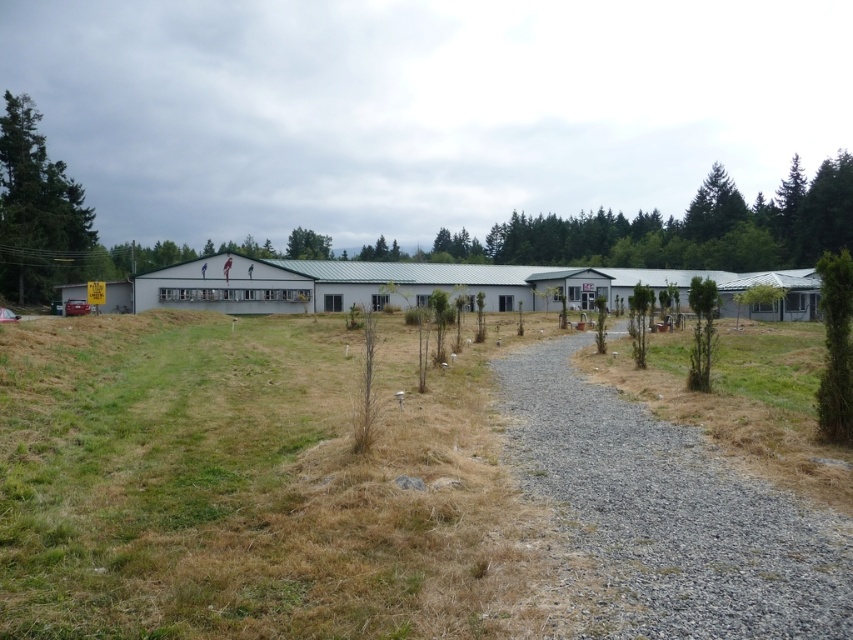
From the picture: Does gray gravel path at center have a lesser width compared to green textured tree at right?

Indeed, gray gravel path at center has a lesser width compared to green textured tree at right.

Who is more distant from viewer, (x=849, y=538) or (x=849, y=280)?

Point (x=849, y=280)

Is point (556, 372) in front of point (840, 301)?

No, (556, 372) is further to viewer.

The width and height of the screenshot is (853, 640). Identify the location of gray gravel path at center. (669, 515).

Between point (572, 392) and point (836, 422), which one is positioned in front?

Point (836, 422) is more forward.

At what (x,y) coordinates should I click in order to perform the action: click on brown dry grass at lower left. Please return your answer as a coordinate pair (x, y). Looking at the image, I should click on pos(373,496).

Identify the location of brown dry grass at lower left. pos(373,496).

Find the location of a particular element. brown dry grass at lower left is located at coordinates (373, 496).

Who is lower down, gray gravel path at center or green textured tree at left?

gray gravel path at center is lower down.

Is gray gravel path at center positioned at the back of green textured tree at left?

No, gray gravel path at center is in front of green textured tree at left.

The image size is (853, 640). In order to click on gray gravel path at center in this screenshot , I will do `click(669, 515)`.